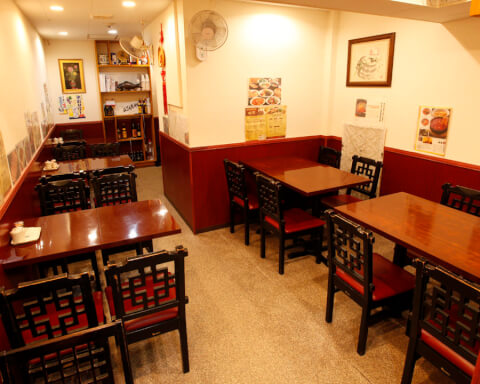
Image resolution: width=480 pixels, height=384 pixels. In order to click on light in this screenshot , I will do `click(131, 2)`.